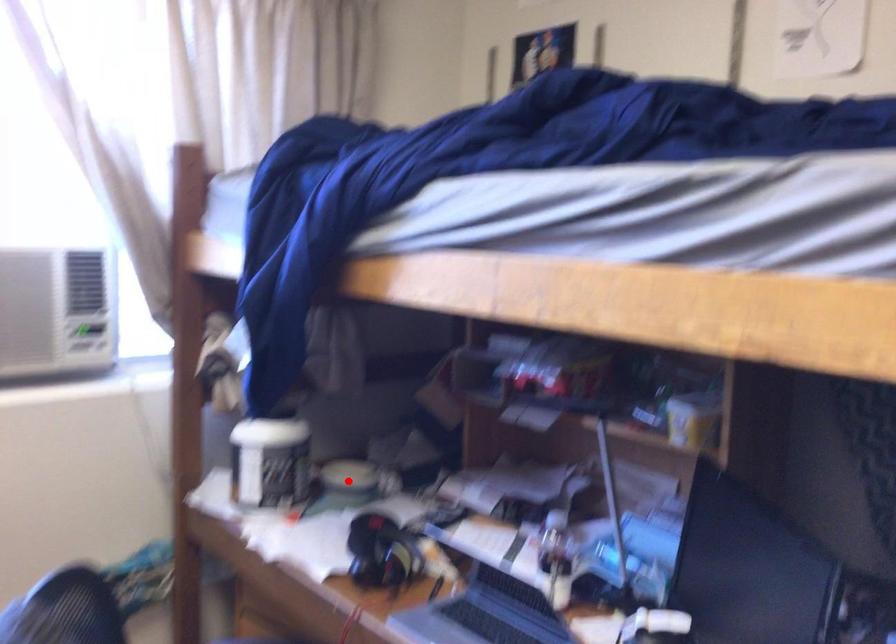
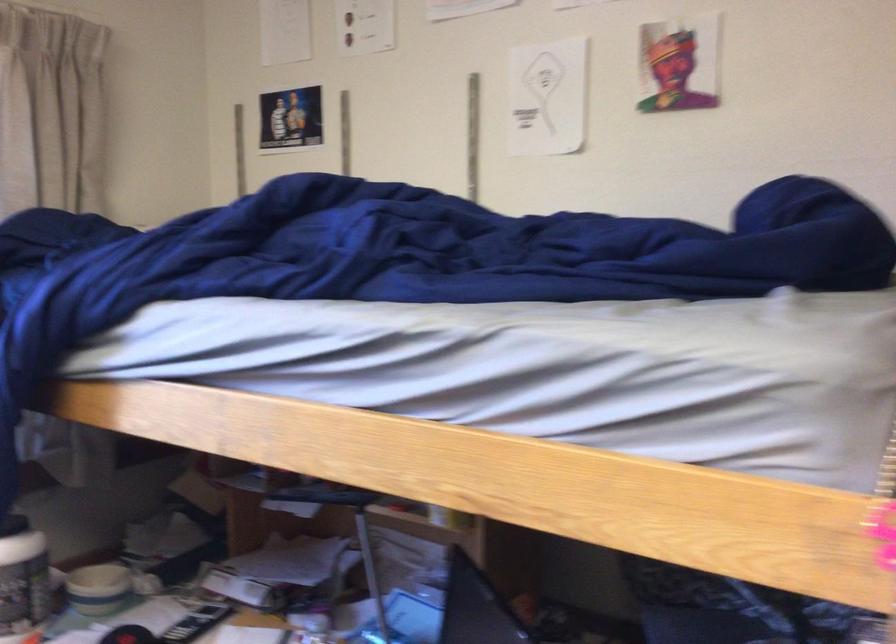
Find the pixel in the second image that matches the highlighted location in the first image.

(98, 589)